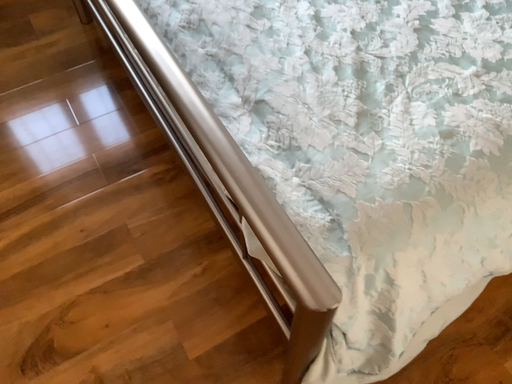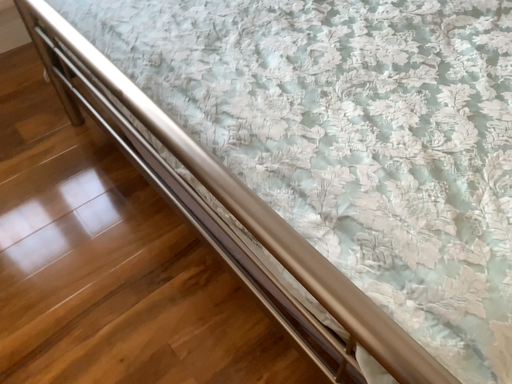
Question: Which way did the camera rotate in the video?

Choices:
 (A) rotated downward
 (B) rotated upward

Answer: (B)